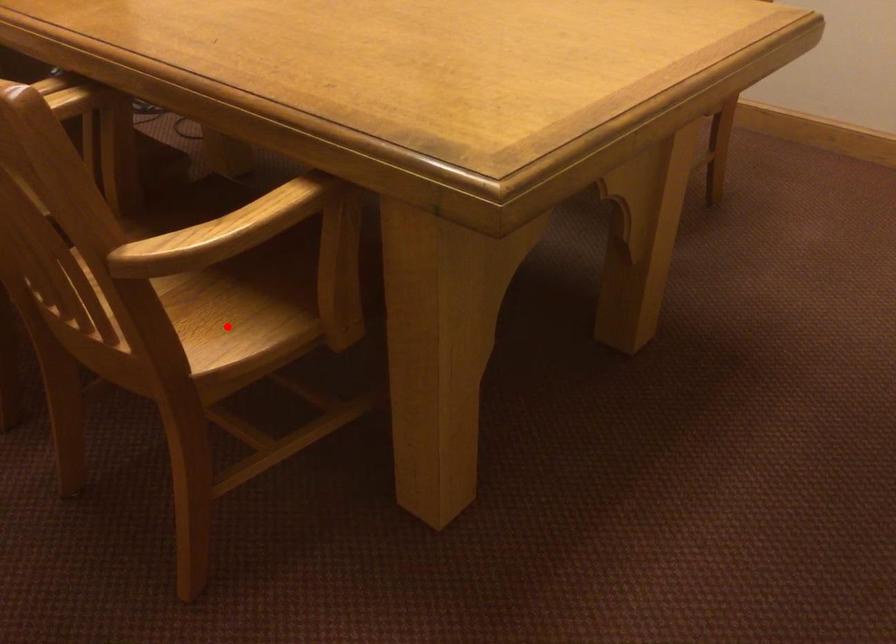
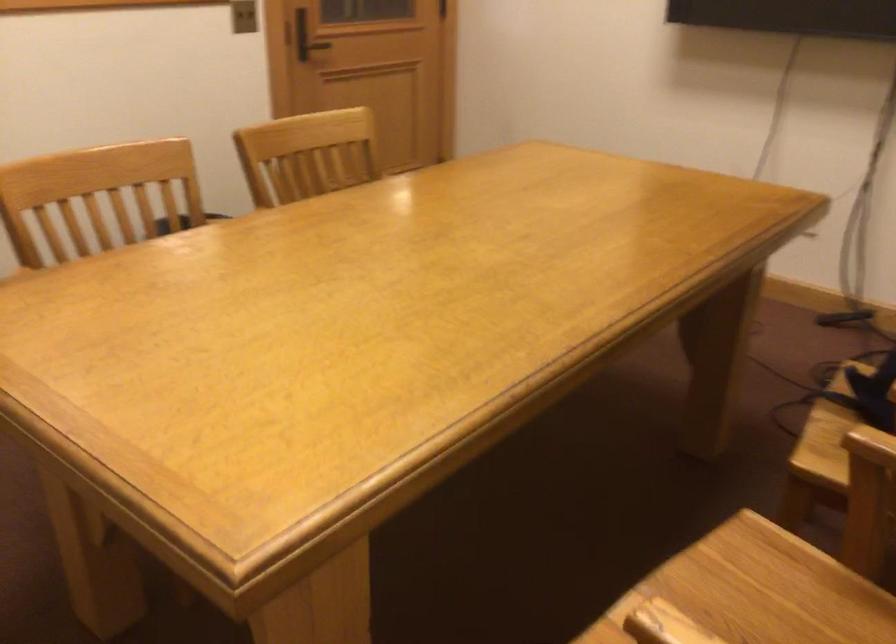
Question: I am providing you with two images of the same scene from different viewpoints. A red point is marked on the first image. Is the red point's position out of view in image 2?

Choices:
 (A) Yes
 (B) No

Answer: (A)